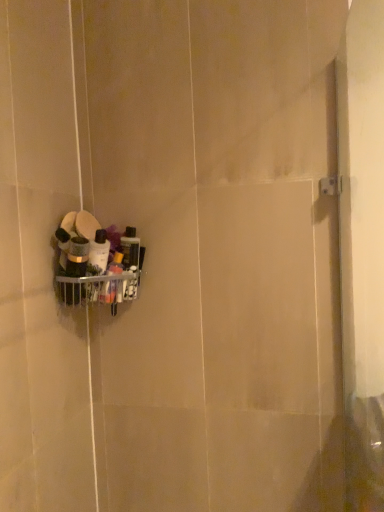
Measure the distance between point (116,275) and camera.

They are 1.10 meters apart.

Describe the element at coordinates (114, 283) in the screenshot. I see `translucent plastic bottle at lower left` at that location.

This screenshot has width=384, height=512. In order to click on translucent plastic bottle at lower left in this screenshot , I will do `click(114, 283)`.

Where is `translucent plastic bottle at lower left`? The image size is (384, 512). translucent plastic bottle at lower left is located at coordinates 114,283.